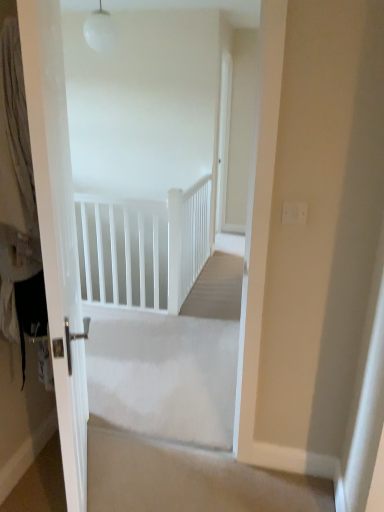
Question: Is white glossy door at left oriented away from white fabric curtain at left?

Choices:
 (A) no
 (B) yes

Answer: (B)

Question: Is white glossy door at left behind white fabric curtain at left?

Choices:
 (A) no
 (B) yes

Answer: (A)

Question: Considering the relative sizes of white glossy door at left and white fabric curtain at left in the image provided, is white glossy door at left smaller than white fabric curtain at left?

Choices:
 (A) yes
 (B) no

Answer: (B)

Question: Considering the relative sizes of white glossy door at left and white fabric curtain at left in the image provided, is white glossy door at left taller than white fabric curtain at left?

Choices:
 (A) yes
 (B) no

Answer: (A)

Question: Is white glossy door at left next to white fabric curtain at left and touching it?

Choices:
 (A) no
 (B) yes

Answer: (A)

Question: Is white fabric curtain at left to the left or to the right of white matte rail at upper center in the image?

Choices:
 (A) left
 (B) right

Answer: (A)

Question: In terms of width, does white fabric curtain at left look wider or thinner when compared to white matte rail at upper center?

Choices:
 (A) wide
 (B) thin

Answer: (A)

Question: Is point (13, 64) positioned closer to the camera than point (187, 215)?

Choices:
 (A) closer
 (B) farther

Answer: (A)

Question: Do you think white fabric curtain at left is within white matte rail at upper center, or outside of it?

Choices:
 (A) outside
 (B) inside

Answer: (A)

Question: From the image's perspective, is white matte rail at upper center above or below beige carpet at center?

Choices:
 (A) above
 (B) below

Answer: (A)

Question: Is white matte rail at upper center in front of or behind beige carpet at center in the image?

Choices:
 (A) front
 (B) behind

Answer: (B)

Question: Would you say white matte rail at upper center is to the left or to the right of beige carpet at center in the picture?

Choices:
 (A) left
 (B) right

Answer: (A)

Question: From a real-world perspective, is white matte rail at upper center above or below beige carpet at center?

Choices:
 (A) below
 (B) above

Answer: (B)

Question: From a real-world perspective, is white fabric curtain at left positioned above or below beige carpet at center?

Choices:
 (A) below
 (B) above

Answer: (B)

Question: From their relative heights in the image, would you say white fabric curtain at left is taller or shorter than beige carpet at center?

Choices:
 (A) short
 (B) tall

Answer: (B)